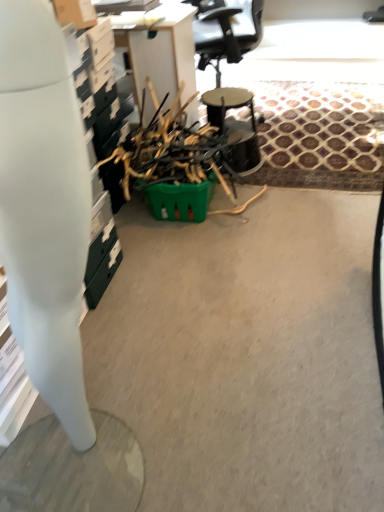
The width and height of the screenshot is (384, 512). I want to click on green plastic basket at center, so click(x=171, y=150).

Based on the photo, is metallic black drum at center located outside white glossy desk at left?

metallic black drum at center lies outside white glossy desk at left's area.

At what (x,y) coordinates should I click in order to perform the action: click on round table lying on the right of white glossy desk at left. Please return your answer as a coordinate pair (x, y). This screenshot has width=384, height=512. Looking at the image, I should click on (234, 126).

Does metallic black drum at center have a greater width compared to white glossy desk at left?

Correct, the width of metallic black drum at center exceeds that of white glossy desk at left.

Is metallic black drum at center aimed at white glossy desk at left?

No, metallic black drum at center is not turned towards white glossy desk at left.

What are the coordinates of `debris on the left of metallic black drum at center` in the screenshot? It's located at (171, 150).

Between metallic black drum at center and green plastic basket at center, which one is positioned in front?

green plastic basket at center.

From a real-world perspective, which is physically below, metallic black drum at center or green plastic basket at center?

metallic black drum at center is physically lower.

Considering the positions of point (234, 104) and point (177, 112), is point (234, 104) closer or farther from the camera than point (177, 112)?

Clearly, point (234, 104) is more distant from the camera than point (177, 112).

From a real-world perspective, who is located higher, white glossy desk at left or metallic black drum at center?

white glossy desk at left.

From the image's perspective, which is above, white glossy desk at left or metallic black drum at center?

metallic black drum at center is shown above in the image.

Is white glossy desk at left facing away from metallic black drum at center?

white glossy desk at left does not have its back to metallic black drum at center.

In the scene shown: Is white glossy desk at left turned away from green plastic basket at center?

No, white glossy desk at left is not facing the opposite direction of green plastic basket at center.

Is white glossy desk at left shorter than green plastic basket at center?

In fact, white glossy desk at left may be taller than green plastic basket at center.

Considering the relative positions of white glossy desk at left and green plastic basket at center in the image provided, is white glossy desk at left to the right of green plastic basket at center from the viewer's perspective?

No.

From a real-world perspective, is white glossy desk at left positioned above or below green plastic basket at center?

From a real-world perspective, white glossy desk at left is physically above green plastic basket at center.

Which of these two, green plastic basket at center or metallic black drum at center, stands shorter?

With less height is metallic black drum at center.

Is green plastic basket at center aimed at metallic black drum at center?

No, green plastic basket at center is not facing towards metallic black drum at center.

Which is in front, green plastic basket at center or metallic black drum at center?

green plastic basket at center is more forward.

Consider the image. Can you confirm if green plastic basket at center is wider than metallic black drum at center?

Yes, green plastic basket at center is wider than metallic black drum at center.

From a real-world perspective, is green plastic basket at center over white glossy desk at left?

No, from a real-world perspective, green plastic basket at center is not over white glossy desk at left

Is green plastic basket at center not near white glossy desk at left?

Absolutely, green plastic basket at center is distant from white glossy desk at left.

Is white glossy desk at left located within green plastic basket at center?

That's incorrect, white glossy desk at left is not inside green plastic basket at center.

In the image, there is a white glossy desk at left. At what (x,y) coordinates should I click in order to perform the action: click on round table above it (from the image's perspective). Please return your answer as a coordinate pair (x, y). Looking at the image, I should click on (234, 126).

The width and height of the screenshot is (384, 512). I want to click on debris lying on the left of metallic black drum at center, so click(x=171, y=150).

Considering their positions, is white glossy desk at left positioned closer to green plastic basket at center than metallic black drum at center?

metallic black drum at center is positioned closer to the anchor green plastic basket at center.

Looking at the image, which one is located closer to metallic black drum at center, green plastic basket at center or white glossy desk at left?

green plastic basket at center is positioned closer to the anchor metallic black drum at center.

Which object lies nearer to the anchor point green plastic basket at center, metallic black drum at center or white glossy desk at left?

metallic black drum at center.

Estimate the real-world distances between objects in this image. Which object is further from white glossy desk at left, metallic black drum at center or green plastic basket at center?

metallic black drum at center.

Looking at the image, which one is located closer to white glossy desk at left, green plastic basket at center or metallic black drum at center?

green plastic basket at center is closer to white glossy desk at left.

Estimate the real-world distances between objects in this image. Which object is closer to metallic black drum at center, white glossy desk at left or green plastic basket at center?

green plastic basket at center is closer to metallic black drum at center.

The image size is (384, 512). Find the location of `debris between white glossy desk at left and metallic black drum at center in the front-back direction`. debris between white glossy desk at left and metallic black drum at center in the front-back direction is located at coordinates (171, 150).